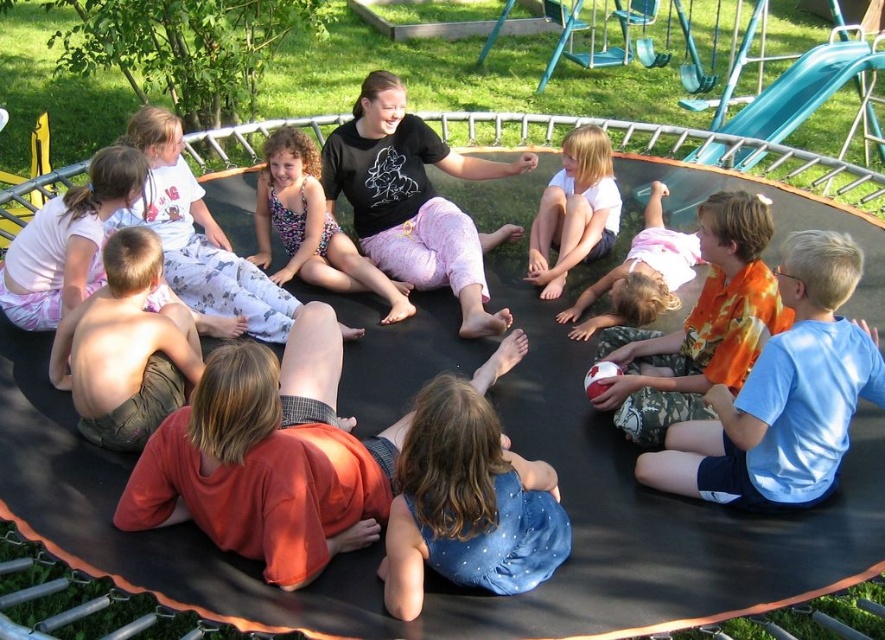
Question: Which object appears closest to the camera in this image?

Choices:
 (A) blue cotton shirt at lower right
 (B) orange tie-dye shirt at right
 (C) teal plastic slide at upper right

Answer: (A)

Question: Which of the following is the closest to the observer?

Choices:
 (A) [753, 396]
 (B) [267, 506]

Answer: (B)

Question: Is orange tie-dye shirt at right closer to camera compared to teal plastic slide at upper right?

Choices:
 (A) no
 (B) yes

Answer: (B)

Question: Observing the image, what is the correct spatial positioning of blue cotton shirt at lower right in reference to black cotton shirt at center?

Choices:
 (A) left
 (B) right

Answer: (B)

Question: Observing the image, what is the correct spatial positioning of orange cotton shirt at center in reference to pink fabric dress at lower center?

Choices:
 (A) right
 (B) left

Answer: (B)

Question: Which object appears farthest from the camera in this image?

Choices:
 (A) black cotton shirt at center
 (B) pink fabric dress at lower center
 (C) white cotton shirt at center

Answer: (C)